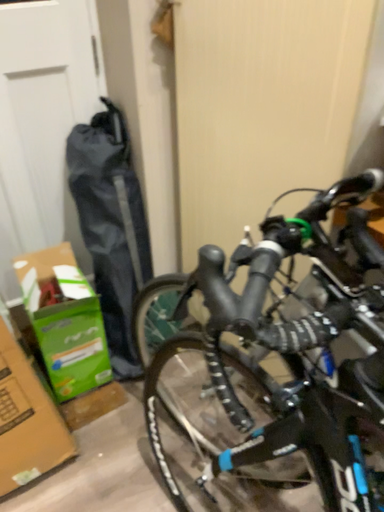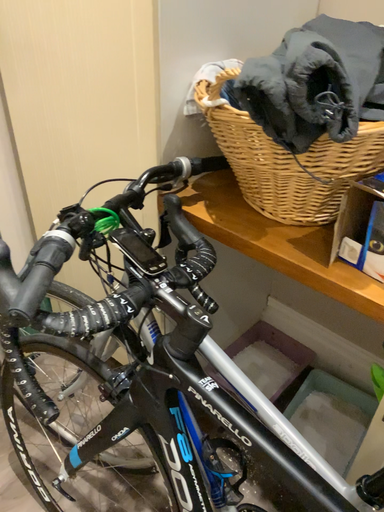
Question: How did the camera likely rotate when shooting the video?

Choices:
 (A) rotated right
 (B) rotated left

Answer: (A)